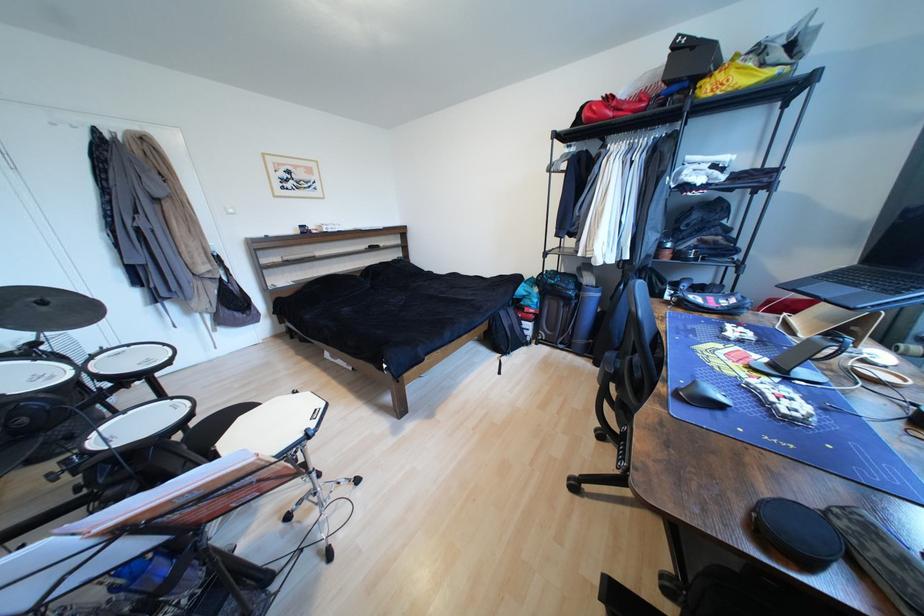
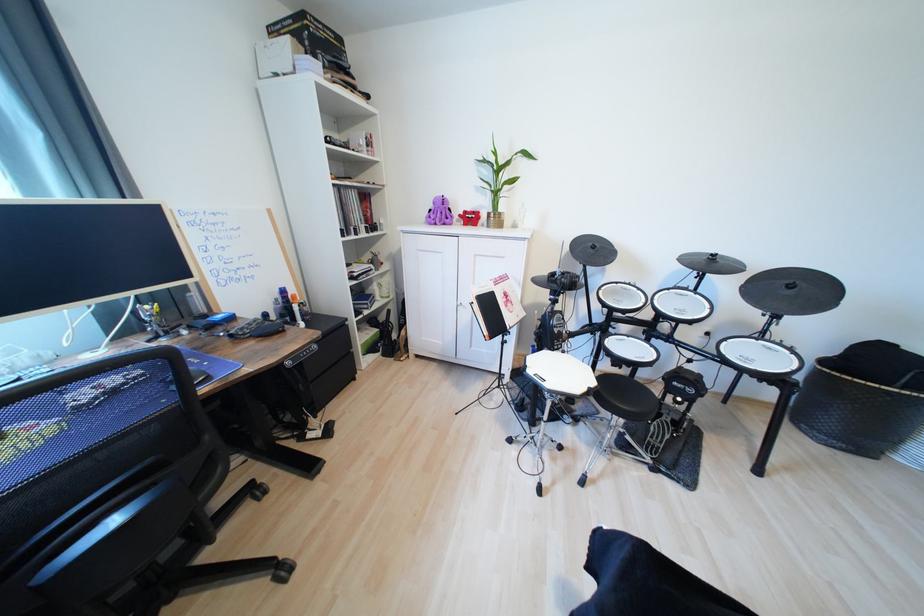
Find the pixel in the second image that matches the point at 49,305 in the first image.

(797, 288)